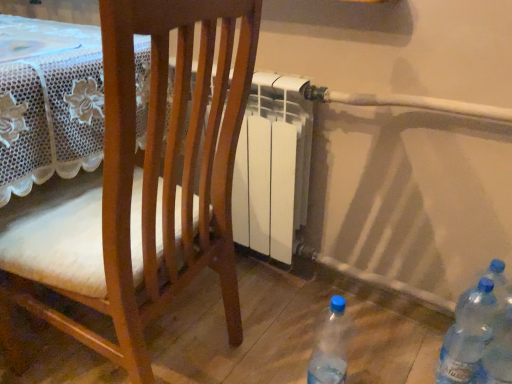
What do you see at coordinates (140, 188) in the screenshot? I see `wooden chair at center` at bounding box center [140, 188].

How much space does transparent plastic bottles at lower right, placed as the second bottle when sorted from left to right, occupy horizontally?

transparent plastic bottles at lower right, placed as the second bottle when sorted from left to right, is 8.34 centimeters in width.

What is the approximate height of transparent plastic bottles at lower right, placed as the 2th bottle when sorted from right to left?

13.16 inches.

This screenshot has height=384, width=512. What are the coordinates of `transparent plastic bottle at lower right, marked as the first bottle in a left-to-right arrangement` in the screenshot? It's located at (330, 346).

How much distance is there between blue translucent bottle at lower right, placed as the first bottle when sorted from right to left, and transparent plastic bottles at lower right, placed as the second bottle when sorted from left to right?

blue translucent bottle at lower right, placed as the first bottle when sorted from right to left, is 4.11 centimeters from transparent plastic bottles at lower right, placed as the second bottle when sorted from left to right.

Which of these two, blue translucent bottle at lower right, acting as the third bottle starting from the left, or transparent plastic bottles at lower right, placed as the second bottle when sorted from left to right, is wider?

transparent plastic bottles at lower right, placed as the second bottle when sorted from left to right.

Based on their sizes in the image, would you say blue translucent bottle at lower right, acting as the third bottle starting from the left, is bigger or smaller than transparent plastic bottles at lower right, placed as the second bottle when sorted from left to right?

Considering their sizes, blue translucent bottle at lower right, acting as the third bottle starting from the left, takes up less space than transparent plastic bottles at lower right, placed as the second bottle when sorted from left to right.

Is blue translucent bottle at lower right, acting as the third bottle starting from the left, turned away from transparent plastic bottles at lower right, placed as the 2th bottle when sorted from right to left?

That's not correct — blue translucent bottle at lower right, acting as the third bottle starting from the left, is not looking away from transparent plastic bottles at lower right, placed as the 2th bottle when sorted from right to left.

From the image's perspective, relative to blue translucent bottle at lower right, acting as the third bottle starting from the left, is transparent plastic bottles at lower right, placed as the 2th bottle when sorted from right to left, above or below?

Clearly, from the image's perspective, transparent plastic bottles at lower right, placed as the 2th bottle when sorted from right to left, is above blue translucent bottle at lower right, acting as the third bottle starting from the left.

Locate an element on the screen. bottle above the blue translucent bottle at lower right, acting as the third bottle starting from the left (from the image's perspective) is located at coordinates (468, 334).

Based on the photo, who is taller, transparent plastic bottles at lower right, placed as the 2th bottle when sorted from right to left, or blue translucent bottle at lower right, placed as the first bottle when sorted from right to left?

With more height is blue translucent bottle at lower right, placed as the first bottle when sorted from right to left.

Does transparent plastic bottles at lower right, placed as the 2th bottle when sorted from right to left, have a smaller size compared to blue translucent bottle at lower right, placed as the first bottle when sorted from right to left?

Actually, transparent plastic bottles at lower right, placed as the 2th bottle when sorted from right to left, might be larger than blue translucent bottle at lower right, placed as the first bottle when sorted from right to left.

From a real-world perspective, does wooden chair at center sit lower than transparent plastic bottle at lower right, which appears as the 3th bottle when viewed from the right?

No, from a real-world perspective, wooden chair at center is not below transparent plastic bottle at lower right, which appears as the 3th bottle when viewed from the right.

Is wooden chair at center closer to the viewer compared to transparent plastic bottle at lower right, marked as the first bottle in a left-to-right arrangement?

Yes.

Is wooden chair at center with transparent plastic bottle at lower right, which appears as the 3th bottle when viewed from the right?

They are not placed beside each other.

Does wooden chair at center turn towards transparent plastic bottles at lower right, placed as the 2th bottle when sorted from right to left?

No, wooden chair at center is not aimed at transparent plastic bottles at lower right, placed as the 2th bottle when sorted from right to left.

In terms of size, does wooden chair at center appear bigger or smaller than transparent plastic bottles at lower right, placed as the second bottle when sorted from left to right?

Clearly, wooden chair at center is larger in size than transparent plastic bottles at lower right, placed as the second bottle when sorted from left to right.

Between wooden chair at center and transparent plastic bottles at lower right, placed as the second bottle when sorted from left to right, which one has more height?

wooden chair at center is taller.

Which object is closer to the camera, wooden chair at center or transparent plastic bottles at lower right, placed as the 2th bottle when sorted from right to left?

wooden chair at center is more forward.

Is blue translucent bottle at lower right, acting as the third bottle starting from the left, far away from transparent plastic bottle at lower right, marked as the first bottle in a left-to-right arrangement?

That's not correct — blue translucent bottle at lower right, acting as the third bottle starting from the left, is a little close to transparent plastic bottle at lower right, marked as the first bottle in a left-to-right arrangement.

From their relative heights in the image, would you say blue translucent bottle at lower right, placed as the first bottle when sorted from right to left, is taller or shorter than transparent plastic bottle at lower right, marked as the first bottle in a left-to-right arrangement?

Clearly, blue translucent bottle at lower right, placed as the first bottle when sorted from right to left, is taller compared to transparent plastic bottle at lower right, marked as the first bottle in a left-to-right arrangement.

What's the angular difference between blue translucent bottle at lower right, acting as the third bottle starting from the left, and transparent plastic bottle at lower right, which appears as the 3th bottle when viewed from the right,'s facing directions?

The angular difference between blue translucent bottle at lower right, acting as the third bottle starting from the left, and transparent plastic bottle at lower right, which appears as the 3th bottle when viewed from the right, is 0.00211 degrees.

At what (x,y) coordinates should I click in order to perform the action: click on the 2nd bottle to the right when counting from the transparent plastic bottle at lower right, which appears as the 3th bottle when viewed from the right. Please return your answer as a coordinate pair (x, y). Looking at the image, I should click on (499, 347).

Between transparent plastic bottle at lower right, marked as the first bottle in a left-to-right arrangement, and blue translucent bottle at lower right, acting as the third bottle starting from the left, which one has larger size?

With larger size is transparent plastic bottle at lower right, marked as the first bottle in a left-to-right arrangement.

Can you confirm if transparent plastic bottle at lower right, which appears as the 3th bottle when viewed from the right, is thinner than blue translucent bottle at lower right, placed as the first bottle when sorted from right to left?

No, transparent plastic bottle at lower right, which appears as the 3th bottle when viewed from the right, is not thinner than blue translucent bottle at lower right, placed as the first bottle when sorted from right to left.

Based on the photo, from the image's perspective, is transparent plastic bottle at lower right, marked as the first bottle in a left-to-right arrangement, located above blue translucent bottle at lower right, acting as the third bottle starting from the left?

No, from the image's perspective, transparent plastic bottle at lower right, marked as the first bottle in a left-to-right arrangement, is not on top of blue translucent bottle at lower right, acting as the third bottle starting from the left.

Is transparent plastic bottle at lower right, which appears as the 3th bottle when viewed from the right, shorter than blue translucent bottle at lower right, acting as the third bottle starting from the left?

Yes.

Could you tell me if transparent plastic bottles at lower right, placed as the second bottle when sorted from left to right, is turned towards transparent plastic bottle at lower right, marked as the first bottle in a left-to-right arrangement?

No, transparent plastic bottles at lower right, placed as the second bottle when sorted from left to right, is not aimed at transparent plastic bottle at lower right, marked as the first bottle in a left-to-right arrangement.

From the image's perspective, who appears lower, transparent plastic bottles at lower right, placed as the 2th bottle when sorted from right to left, or transparent plastic bottle at lower right, marked as the first bottle in a left-to-right arrangement?

transparent plastic bottle at lower right, marked as the first bottle in a left-to-right arrangement.

From a real-world perspective, is transparent plastic bottles at lower right, placed as the second bottle when sorted from left to right, physically below transparent plastic bottle at lower right, which appears as the 3th bottle when viewed from the right?

No, from a real-world perspective, transparent plastic bottles at lower right, placed as the second bottle when sorted from left to right, is not beneath transparent plastic bottle at lower right, which appears as the 3th bottle when viewed from the right.

Is transparent plastic bottles at lower right, placed as the 2th bottle when sorted from right to left, wider than transparent plastic bottle at lower right, marked as the first bottle in a left-to-right arrangement?

In fact, transparent plastic bottles at lower right, placed as the 2th bottle when sorted from right to left, might be narrower than transparent plastic bottle at lower right, marked as the first bottle in a left-to-right arrangement.

Identify the location of bottle that is above the blue translucent bottle at lower right, acting as the third bottle starting from the left (from the image's perspective). This screenshot has height=384, width=512. (468, 334).

Locate an element on the screen. the 1st bottle below when counting from the transparent plastic bottles at lower right, placed as the 2th bottle when sorted from right to left (from the image's perspective) is located at coordinates (499, 347).

When comparing their distances from transparent plastic bottle at lower right, which appears as the 3th bottle when viewed from the right, does transparent plastic bottles at lower right, placed as the second bottle when sorted from left to right, or wooden chair at center seem further?

wooden chair at center.

Which object lies further to the anchor point transparent plastic bottle at lower right, marked as the first bottle in a left-to-right arrangement, wooden chair at center or blue translucent bottle at lower right, acting as the third bottle starting from the left?

wooden chair at center.

Considering their positions, is wooden chair at center positioned further to transparent plastic bottles at lower right, placed as the 2th bottle when sorted from right to left, than blue translucent bottle at lower right, placed as the first bottle when sorted from right to left?

wooden chair at center.

Based on the photo, which object lies further to the anchor point blue translucent bottle at lower right, acting as the third bottle starting from the left, transparent plastic bottle at lower right, marked as the first bottle in a left-to-right arrangement, or wooden chair at center?

wooden chair at center.

Which object lies nearer to the anchor point blue translucent bottle at lower right, placed as the first bottle when sorted from right to left, wooden chair at center or transparent plastic bottles at lower right, placed as the 2th bottle when sorted from right to left?

transparent plastic bottles at lower right, placed as the 2th bottle when sorted from right to left.

When comparing their distances from transparent plastic bottles at lower right, placed as the 2th bottle when sorted from right to left, does blue translucent bottle at lower right, placed as the first bottle when sorted from right to left, or transparent plastic bottle at lower right, which appears as the 3th bottle when viewed from the right, seem further?

transparent plastic bottle at lower right, which appears as the 3th bottle when viewed from the right, is positioned further to the anchor transparent plastic bottles at lower right, placed as the 2th bottle when sorted from right to left.

When comparing their distances from transparent plastic bottles at lower right, placed as the second bottle when sorted from left to right, does transparent plastic bottle at lower right, marked as the first bottle in a left-to-right arrangement, or wooden chair at center seem further?

The object further to transparent plastic bottles at lower right, placed as the second bottle when sorted from left to right, is wooden chair at center.

Looking at the image, which one is located further to transparent plastic bottle at lower right, marked as the first bottle in a left-to-right arrangement, blue translucent bottle at lower right, placed as the first bottle when sorted from right to left, or wooden chair at center?

Among the two, wooden chair at center is located further to transparent plastic bottle at lower right, marked as the first bottle in a left-to-right arrangement.

This screenshot has height=384, width=512. What are the coordinates of `bottle situated between wooden chair at center and transparent plastic bottles at lower right, placed as the second bottle when sorted from left to right, from left to right` in the screenshot? It's located at (330, 346).

Find the location of a particular element. bottle situated between transparent plastic bottle at lower right, marked as the first bottle in a left-to-right arrangement, and blue translucent bottle at lower right, acting as the third bottle starting from the left, from left to right is located at coordinates (468, 334).